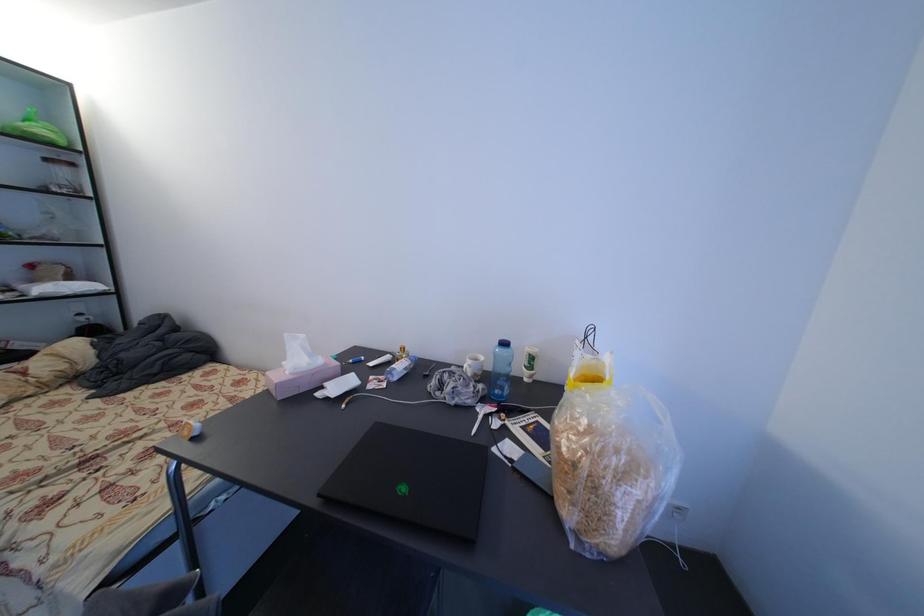
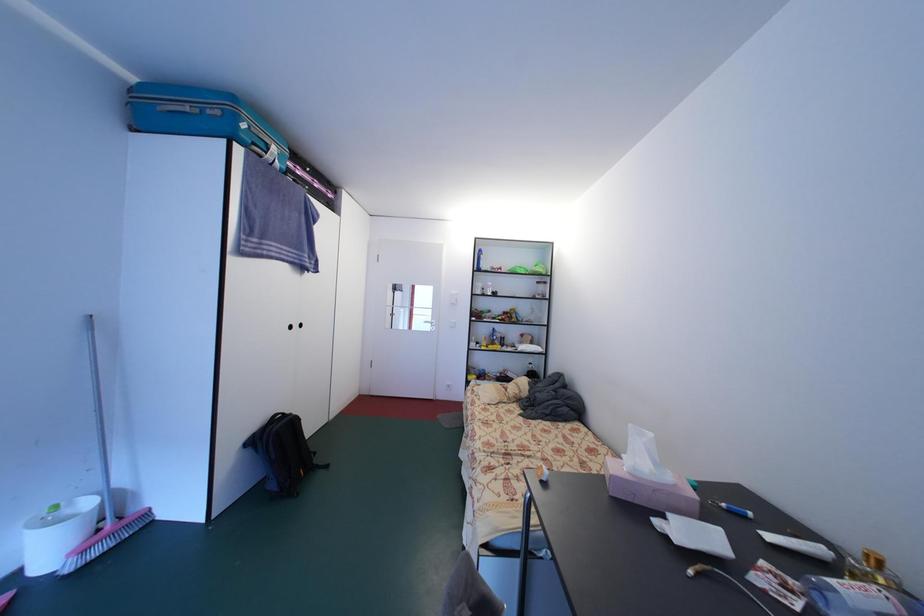
Question: The camera is either moving clockwise (left) or counter-clockwise (right) around the object. The first image is from the beginning of the video and the second image is from the end. Is the camera moving left or right when shooting the video?

Choices:
 (A) Left
 (B) Right

Answer: (B)